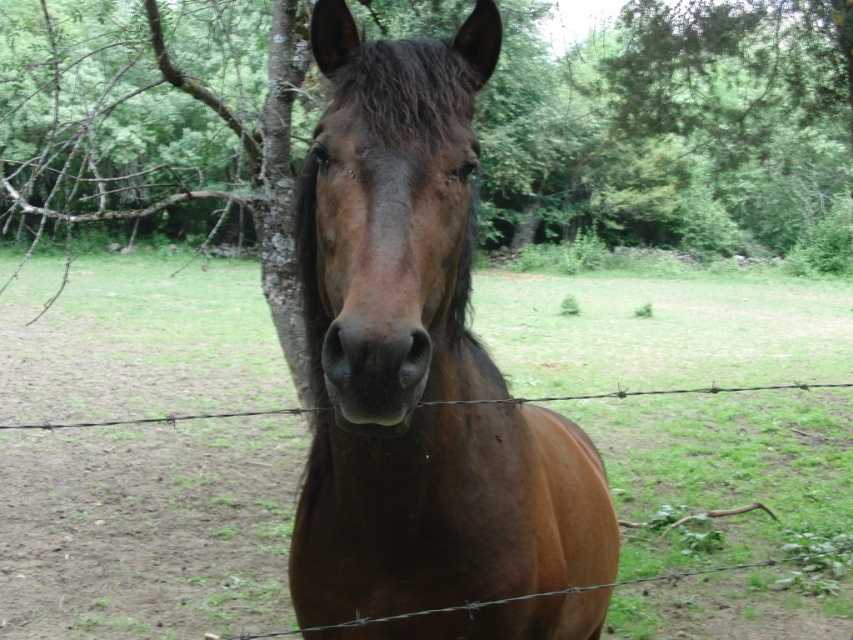
Question: Which of the following is the closest to the observer?

Choices:
 (A) brown glossy horse at center
 (B) green grass at center

Answer: (A)

Question: Can you confirm if green grass at center is thinner than brown glossy horse at center?

Choices:
 (A) no
 (B) yes

Answer: (A)

Question: Does green grass at center have a larger size compared to brown glossy horse at center?

Choices:
 (A) no
 (B) yes

Answer: (B)

Question: Which object is farther from the camera taking this photo?

Choices:
 (A) brown glossy horse at center
 (B) green grass at center

Answer: (B)

Question: Does green grass at center have a smaller size compared to brown glossy horse at center?

Choices:
 (A) yes
 (B) no

Answer: (B)

Question: Which point is farther to the camera?

Choices:
 (A) (399, 435)
 (B) (807, 346)

Answer: (B)